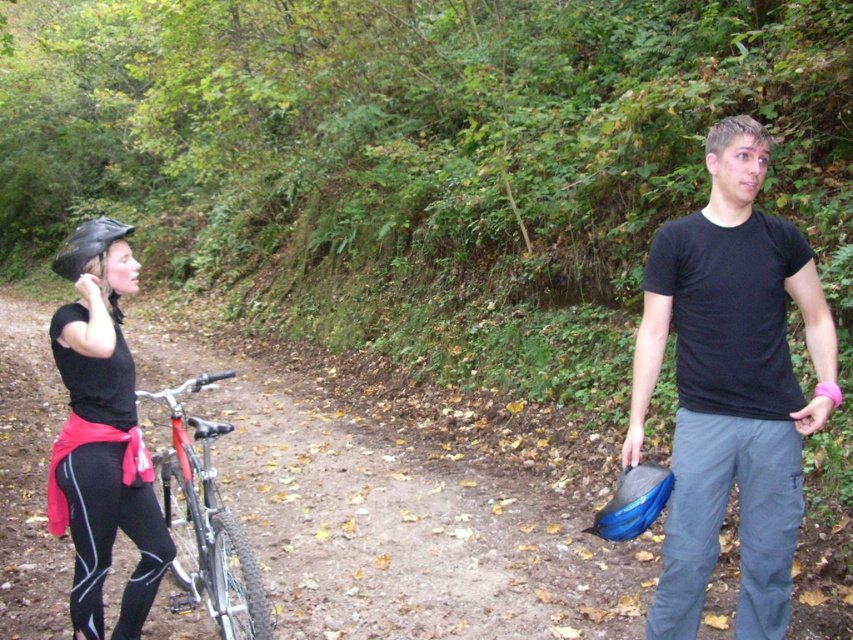
From the picture: You are standing on the dirt path and want to know which of the two points, point (785,538) or point (123,490), is closer to you. Can you determine this based on the scene?

Point (785,538) is closer to the viewer than point (123,490).